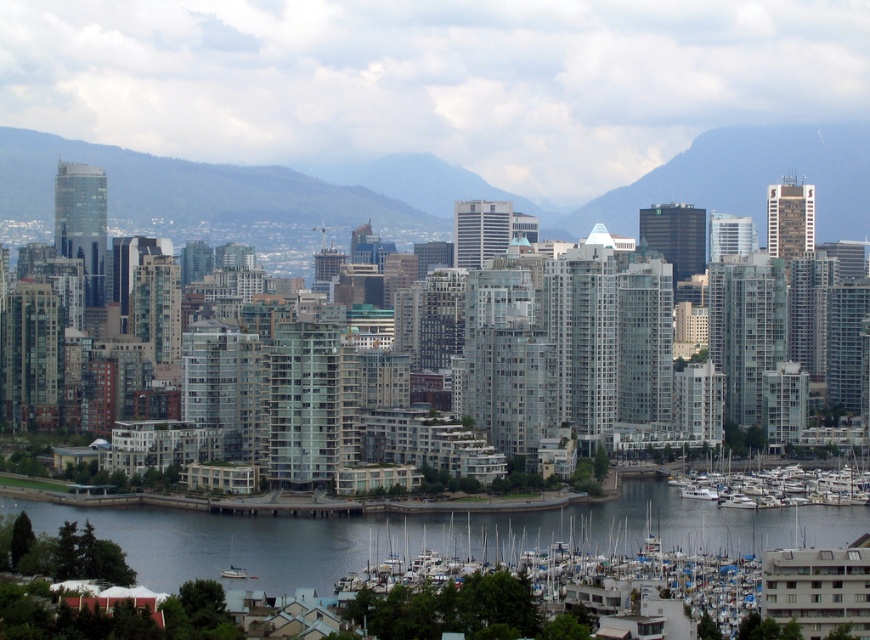
Question: Which object is the closest to the green forested mountain at upper center?

Choices:
 (A) white matte boats at lower right
 (B) white glossy boats at lower right

Answer: (B)

Question: Which of the following is the farthest from the observer?

Choices:
 (A) (785, 518)
 (B) (708, 465)

Answer: (A)

Question: From the image, what is the correct spatial relationship of transparent water at lower center in relation to white matte boats at lower right?

Choices:
 (A) above
 (B) below

Answer: (A)

Question: Which point is closer to the camera?

Choices:
 (A) (561, 516)
 (B) (392, 602)

Answer: (A)

Question: Can you confirm if transparent water at lower center is thinner than green forested mountain at upper center?

Choices:
 (A) no
 (B) yes

Answer: (A)

Question: Is the position of green forested mountain at upper center less distant than that of white matte boats at lower right?

Choices:
 (A) no
 (B) yes

Answer: (A)